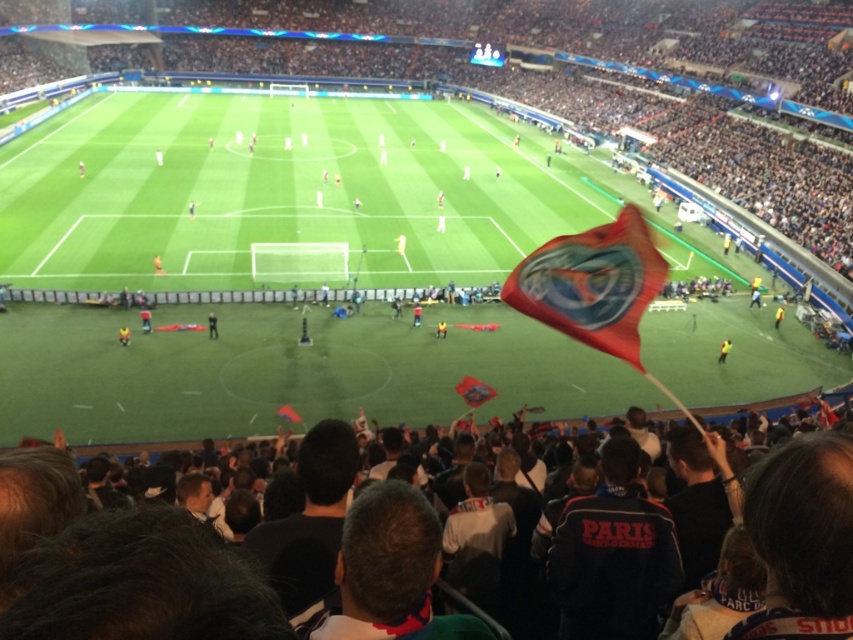
Question: Can you confirm if dark gray fabric crowd at lower center is smaller than yellow fabric flag at center?

Choices:
 (A) no
 (B) yes

Answer: (A)

Question: Which point appears farthest from the camera in this image?

Choices:
 (A) (728, 346)
 (B) (126, 342)
 (C) (479, 400)
 (D) (634, 348)

Answer: (A)

Question: Considering the real-world distances, which object is farthest from the dark gray fabric crowd at lower center?

Choices:
 (A) red fabric flag at center
 (B) yellow reflective vest at center
 (C) yellow jersey at center

Answer: (C)

Question: Which object is farther from the camera taking this photo?

Choices:
 (A) yellow reflective vest at center
 (B) yellow jersey at center
 (C) red fabric flag at center

Answer: (B)

Question: Does polyester flag at center have a greater width compared to black fabric flag at center?

Choices:
 (A) no
 (B) yes

Answer: (B)

Question: Observing the image, what is the correct spatial positioning of yellow reflective vest at center in reference to yellow jersey at center?

Choices:
 (A) right
 (B) left

Answer: (A)